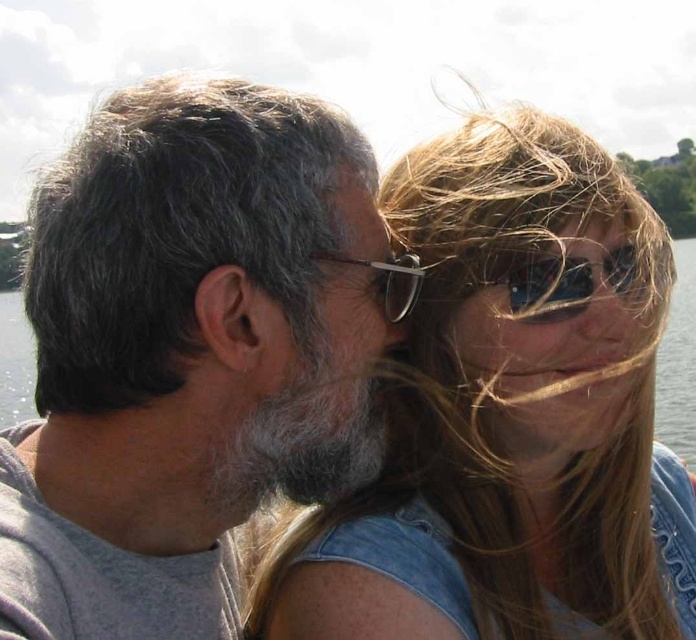
Question: Which of the following is the farthest from the observer?

Choices:
 (A) black plastic goggles at upper center
 (B) denim jacket at upper right
 (C) transparent water at center

Answer: (C)

Question: Among these objects, which one is nearest to the camera?

Choices:
 (A) matte black hair at upper center
 (B) metallic reflective glasses at center
 (C) gray matte hair at left
 (D) denim jacket at upper right

Answer: (C)

Question: Does gray matte hair at left have a larger size compared to metallic reflective glasses at center?

Choices:
 (A) no
 (B) yes

Answer: (B)

Question: Which point is farther to the camera?

Choices:
 (A) matte black hair at upper center
 (B) denim jacket at upper right

Answer: (B)

Question: Is denim jacket at upper right to the right of metallic reflective glasses at center from the viewer's perspective?

Choices:
 (A) no
 (B) yes

Answer: (B)

Question: Can you confirm if gray matte hair at left is positioned to the left of transparent water at center?

Choices:
 (A) yes
 (B) no

Answer: (A)